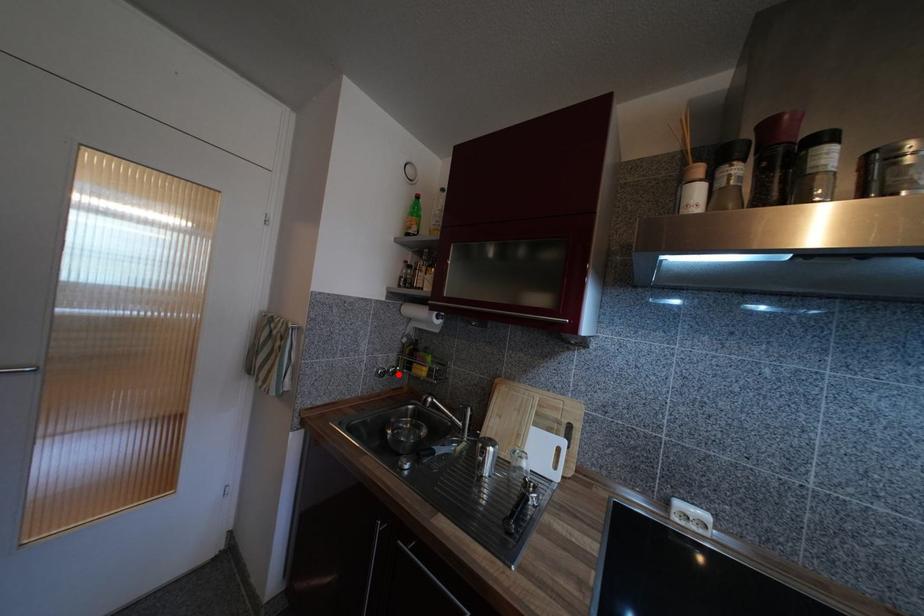
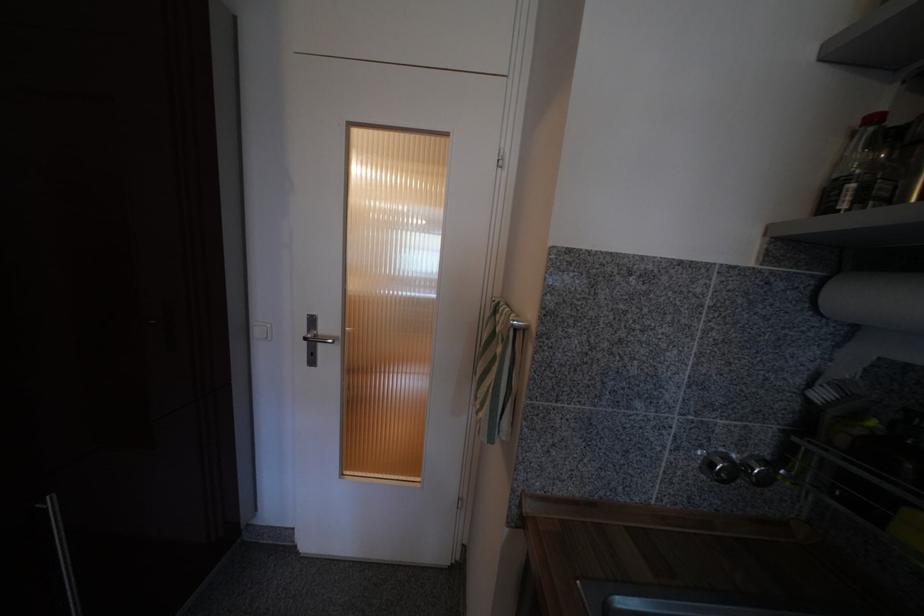
Question: A red point is marked in image1. In image2, is the corresponding 3D point closer to the camera or farther? Reply with the corresponding letter.

Choices:
 (A) The corresponding 3D point is closer.
 (B) The corresponding 3D point is farther.

Answer: (A)